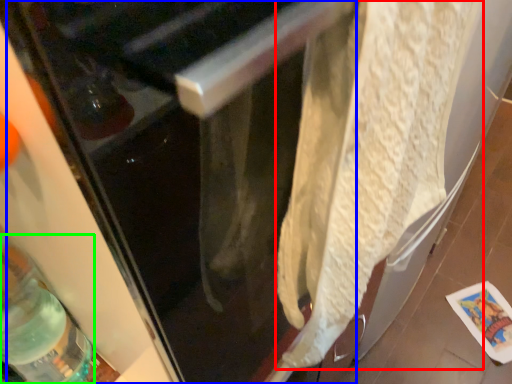
Question: Which object is the closest to the wrap (highlighted by a red box)? Choose among these: screen door (highlighted by a blue box) or bottle (highlighted by a green box).

Choices:
 (A) screen door
 (B) bottle

Answer: (A)